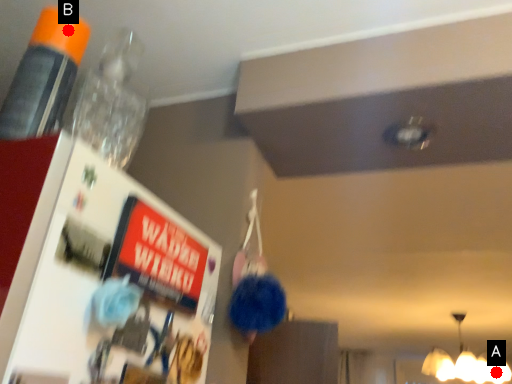
Question: Two points are circled on the image, labeled by A and B beside each circle. Which of the following is the farthest from the observer?

Choices:
 (A) A is further
 (B) B is further

Answer: (A)